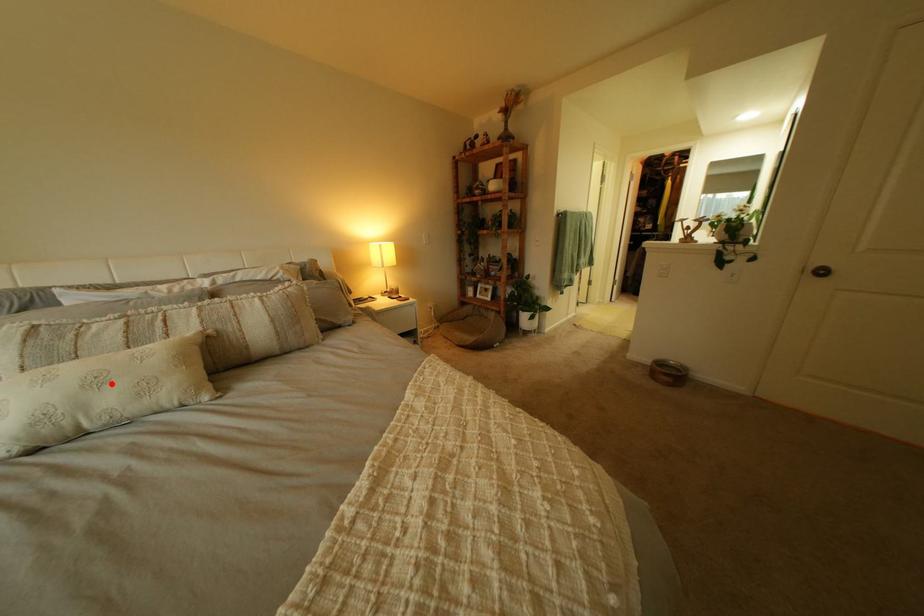
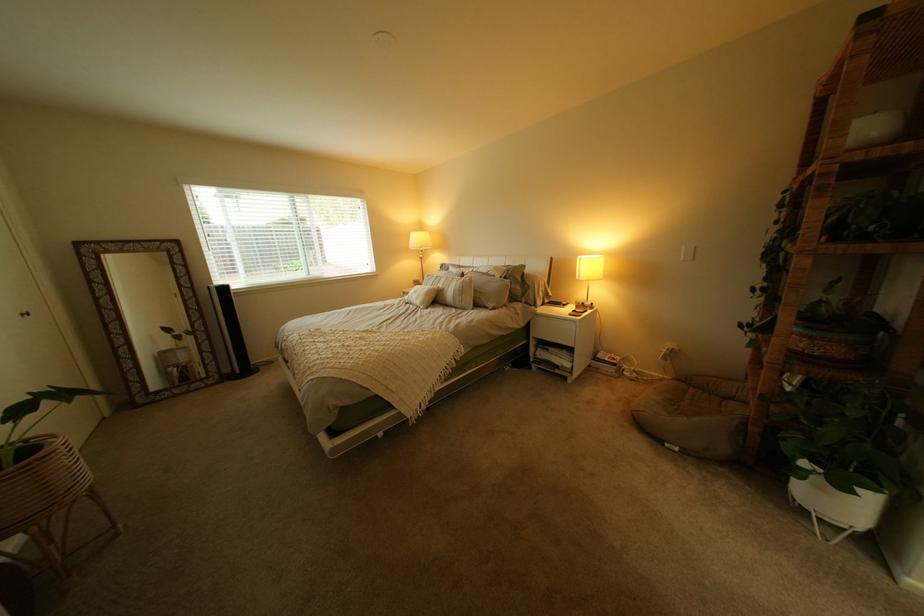
The point at the highlighted location is marked in the first image. Where is the corresponding point in the second image?

(431, 293)